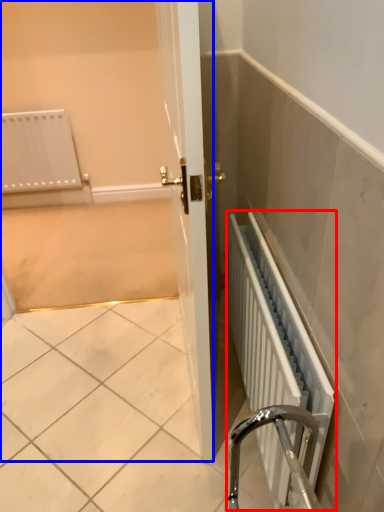
Question: Which point is further to the camera, radiator (highlighted by a red box) or screen door (highlighted by a blue box)?

Choices:
 (A) radiator
 (B) screen door

Answer: (B)